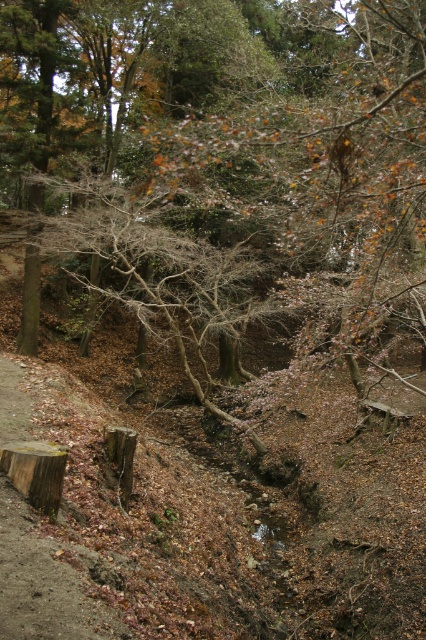
Question: Does brown textured tree at center have a larger size compared to brown rough tree stump at center?

Choices:
 (A) no
 (B) yes

Answer: (B)

Question: Can you confirm if brown rough tree stump at lower left is positioned to the left of brown rough tree stump at center?

Choices:
 (A) no
 (B) yes

Answer: (B)

Question: Does brown textured tree at center have a lesser width compared to brown rough tree stump at lower left?

Choices:
 (A) yes
 (B) no

Answer: (B)

Question: Which point is farther to the camera?

Choices:
 (A) brown rough tree stump at lower left
 (B) brown mossy log at lower left
 (C) brown rough tree stump at center
 (D) brown textured tree at center

Answer: (B)

Question: Which point appears closest to the camera in this image?

Choices:
 (A) (20, 520)
 (B) (120, 456)

Answer: (A)

Question: Based on their relative distances, which object is farther from the brown rough tree stump at lower left?

Choices:
 (A) brown textured tree at center
 (B) brown rough tree stump at center

Answer: (A)